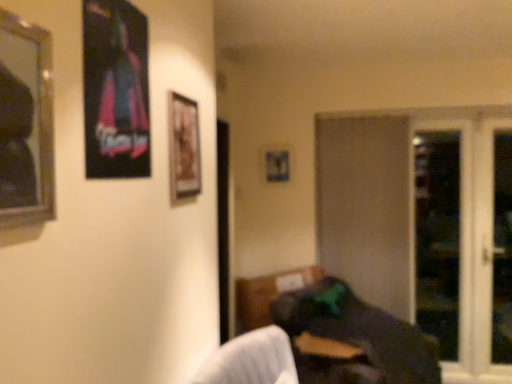
Question: Considering the relative sizes of metallic poster at upper left, the second picture frame viewed from the front, and white glass screen door at right, the 1th screen door positioned from the right, in the image provided, is metallic poster at upper left, the second picture frame viewed from the front, wider than white glass screen door at right, the 1th screen door positioned from the right,?

Choices:
 (A) yes
 (B) no

Answer: (B)

Question: From a real-world perspective, is metallic poster at upper left, placed as the third picture frame when sorted from back to front, on white glass screen door at right, arranged as the 4th screen door when viewed from the left?

Choices:
 (A) no
 (B) yes

Answer: (B)

Question: Is metallic poster at upper left, the second picture frame in the left-to-right sequence, with white glass screen door at right, arranged as the 4th screen door when viewed from the left?

Choices:
 (A) no
 (B) yes

Answer: (A)

Question: From a real-world perspective, is metallic poster at upper left, the second picture frame in the left-to-right sequence, beneath white glass screen door at right, the 1th screen door positioned from the right?

Choices:
 (A) yes
 (B) no

Answer: (B)

Question: Is the position of metallic poster at upper left, the third picture frame from the right, more distant than that of white glass screen door at right, arranged as the 4th screen door when viewed from the left?

Choices:
 (A) yes
 (B) no

Answer: (B)

Question: Does metallic poster at upper left, placed as the third picture frame when sorted from back to front, turn towards white glass screen door at right, the 1th screen door positioned from the right?

Choices:
 (A) no
 (B) yes

Answer: (A)

Question: Considering the relative positions of transparent glass screen door at right, marked as the second screen door in a left-to-right arrangement, and silver-framed mirror at left, arranged as the 4th picture frame when viewed from the back, in the image provided, is transparent glass screen door at right, marked as the second screen door in a left-to-right arrangement, in front of silver-framed mirror at left, arranged as the 4th picture frame when viewed from the back,?

Choices:
 (A) yes
 (B) no

Answer: (B)

Question: Can you confirm if transparent glass screen door at right, the 3th screen door positioned from the right, is smaller than silver-framed mirror at left, arranged as the first picture frame when viewed from the left?

Choices:
 (A) no
 (B) yes

Answer: (A)

Question: Is transparent glass screen door at right, marked as the second screen door in a left-to-right arrangement, wider than silver-framed mirror at left, positioned as the 4th picture frame in right-to-left order?

Choices:
 (A) no
 (B) yes

Answer: (B)

Question: Is transparent glass screen door at right, the 3th screen door positioned from the right, turned away from silver-framed mirror at left, arranged as the first picture frame when viewed from the left?

Choices:
 (A) yes
 (B) no

Answer: (B)

Question: Does transparent glass screen door at right, marked as the second screen door in a left-to-right arrangement, appear on the right side of silver-framed mirror at left, which is the first picture frame from front to back?

Choices:
 (A) yes
 (B) no

Answer: (A)

Question: Is transparent glass screen door at right, the 3th screen door positioned from the right, not within silver-framed mirror at left, positioned as the 4th picture frame in right-to-left order?

Choices:
 (A) no
 (B) yes

Answer: (B)

Question: From the image's perspective, is metallic silver picture frame at center, which is the first picture frame from right to left, below silver-framed mirror at left, arranged as the 4th picture frame when viewed from the back?

Choices:
 (A) yes
 (B) no

Answer: (B)